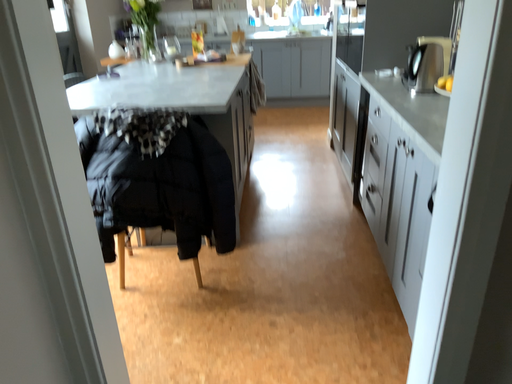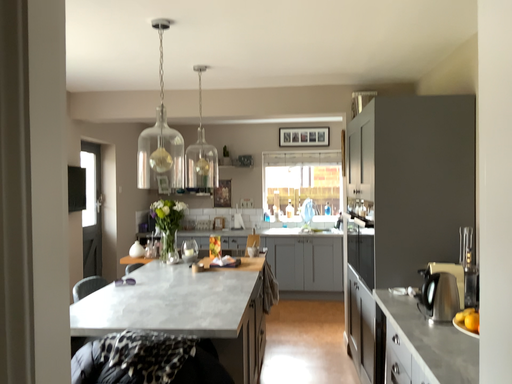
Question: Which way did the camera rotate in the video?

Choices:
 (A) rotated downward
 (B) rotated upward

Answer: (B)